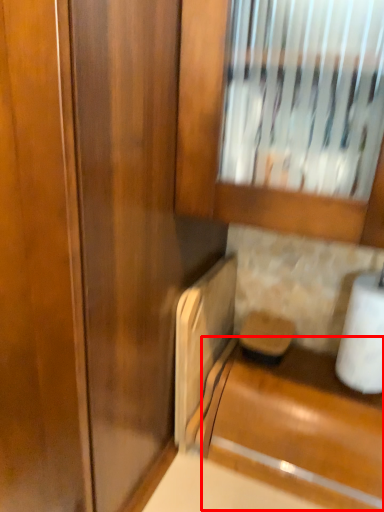
Question: From the image's perspective, what is the correct spatial positioning of cabinetry (annotated by the red box) in reference to toilet paper?

Choices:
 (A) below
 (B) above

Answer: (A)